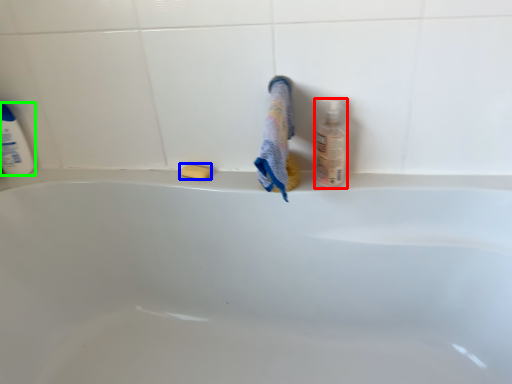
Question: Considering the real-world distances, which object is closest to cleaning product (highlighted by a red box)? soap (highlighted by a blue box) or cleaning product (highlighted by a green box).

Choices:
 (A) soap
 (B) cleaning product

Answer: (A)